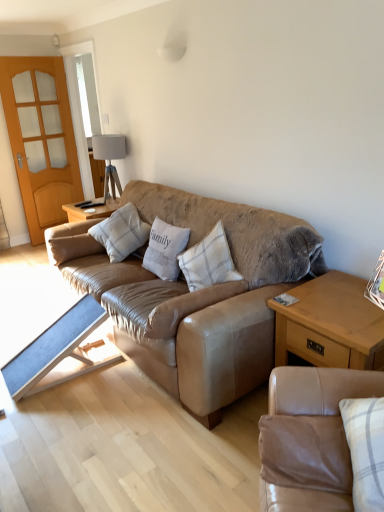
Question: Can you see leather couch at center, the 1th studio couch viewed from the back, touching light gray textured pillow at center, which ranks as the first pillow in left-to-right order?

Choices:
 (A) no
 (B) yes

Answer: (A)

Question: Can we say leather couch at center, the 2th studio couch positioned from the bottom, lies outside light gray textured pillow at center, which ranks as the first pillow in left-to-right order?

Choices:
 (A) no
 (B) yes

Answer: (B)

Question: Would you say leather couch at center, the first studio couch positioned from the top, is a long distance from light gray textured pillow at center, which appears as the 4th pillow when viewed from the right?

Choices:
 (A) yes
 (B) no

Answer: (B)

Question: Considering the relative sizes of leather couch at center, the first studio couch positioned from the top, and light gray textured pillow at center, which ranks as the first pillow in left-to-right order, in the image provided, is leather couch at center, the first studio couch positioned from the top, smaller than light gray textured pillow at center, which ranks as the first pillow in left-to-right order,?

Choices:
 (A) yes
 (B) no

Answer: (B)

Question: Can you confirm if leather couch at center, the 1th studio couch viewed from the back, is wider than light gray textured pillow at center, which appears as the 4th pillow when viewed from the right?

Choices:
 (A) yes
 (B) no

Answer: (A)

Question: Considering the relative positions of leather couch at center, the 2th studio couch viewed from the front, and light gray textured pillow at center, which ranks as the first pillow in left-to-right order, in the image provided, is leather couch at center, the 2th studio couch viewed from the front, to the right of light gray textured pillow at center, which ranks as the first pillow in left-to-right order, from the viewer's perspective?

Choices:
 (A) no
 (B) yes

Answer: (B)

Question: Does white cotton pillow at center, which is the 3th pillow from left to right, contain blue fabric table at lower left, which appears as the 2th table when viewed from the right?

Choices:
 (A) yes
 (B) no

Answer: (B)

Question: Is white cotton pillow at center, which ranks as the 2th pillow in right-to-left order, facing towards blue fabric table at lower left, the first table when ordered from left to right?

Choices:
 (A) yes
 (B) no

Answer: (A)

Question: Does white cotton pillow at center, which ranks as the 2th pillow in right-to-left order, have a lesser width compared to blue fabric table at lower left, which appears as the 2th table when viewed from the right?

Choices:
 (A) yes
 (B) no

Answer: (A)

Question: From the image's perspective, is white cotton pillow at center, which ranks as the 2th pillow in right-to-left order, on blue fabric table at lower left, which appears as the 2th table when viewed from the right?

Choices:
 (A) no
 (B) yes

Answer: (B)

Question: Is white cotton pillow at center, which is the 3th pillow from left to right, bigger than blue fabric table at lower left, the first table when ordered from left to right?

Choices:
 (A) yes
 (B) no

Answer: (B)

Question: Is white cotton pillow at center, which ranks as the 2th pillow in right-to-left order, at the left side of blue fabric table at lower left, which appears as the 2th table when viewed from the right?

Choices:
 (A) no
 (B) yes

Answer: (A)

Question: From the image's perspective, does leather couch at center, the 2th studio couch viewed from the front, appear lower than tan leather couch at lower right, positioned as the first studio couch in bottom-to-top order?

Choices:
 (A) yes
 (B) no

Answer: (B)